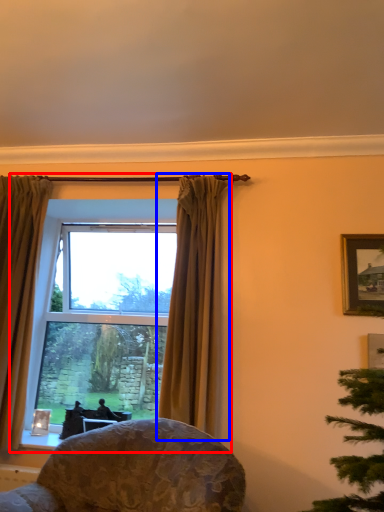
Question: Among these objects, which one is nearest to the camera, window (highlighted by a red box) or curtain (highlighted by a blue box)?

Choices:
 (A) window
 (B) curtain

Answer: (B)